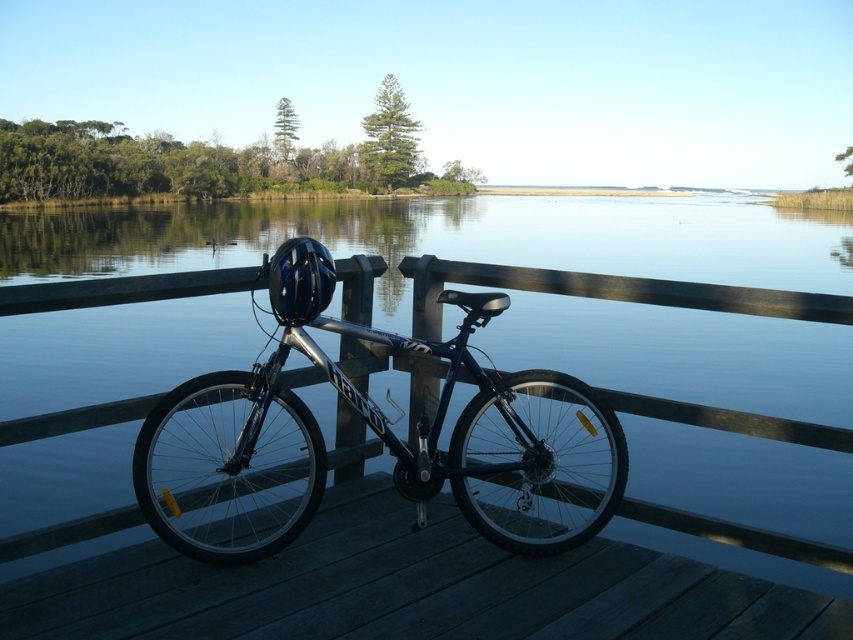
Between point (807, 618) and point (294, 332), which one is positioned behind?

The point (294, 332) is behind.

Does dark wood dock at center appear under shiny metallic bicycle at center?

Yes, dark wood dock at center is below shiny metallic bicycle at center.

Who is more forward, [427,632] or [312,513]?

Point [427,632] is more forward.

The image size is (853, 640). I want to click on dark wood dock at center, so click(409, 589).

Is transparent water at center below dark wood dock at center?

No.

Who is lower down, transparent water at center or dark wood dock at center?

dark wood dock at center is below.

The height and width of the screenshot is (640, 853). Describe the element at coordinates (448, 237) in the screenshot. I see `transparent water at center` at that location.

Identify the location of transparent water at center. (448, 237).

Can you confirm if transparent water at center is thinner than shiny metallic bicycle at center?

In fact, transparent water at center might be wider than shiny metallic bicycle at center.

Is point (578, 356) less distant than point (479, 292)?

No.

The width and height of the screenshot is (853, 640). Find the location of `transparent water at center`. transparent water at center is located at coordinates (448, 237).